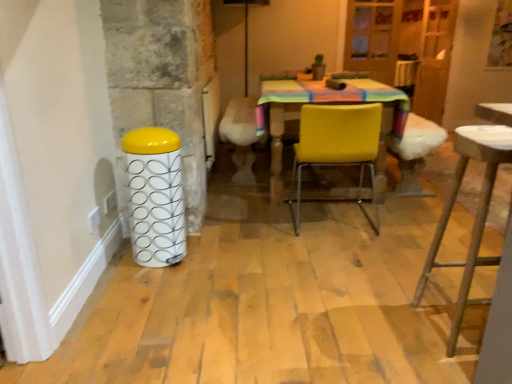
This screenshot has width=512, height=384. In order to click on free spot to the right of white glossy bar stool at left in this screenshot , I will do `click(206, 256)`.